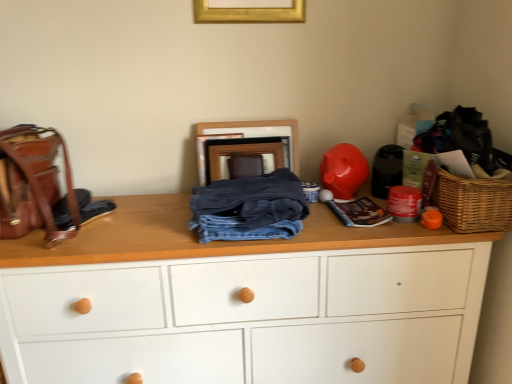
Question: Is white painted wood chest of drawers at center located outside denim fabric pants at center?

Choices:
 (A) yes
 (B) no

Answer: (A)

Question: Is denim fabric pants at center at the back of white painted wood chest of drawers at center?

Choices:
 (A) yes
 (B) no

Answer: (B)

Question: From a real-world perspective, is white painted wood chest of drawers at center on denim fabric pants at center?

Choices:
 (A) yes
 (B) no

Answer: (B)

Question: Considering the relative sizes of white painted wood chest of drawers at center and denim fabric pants at center in the image provided, is white painted wood chest of drawers at center taller than denim fabric pants at center?

Choices:
 (A) yes
 (B) no

Answer: (A)

Question: Can you confirm if white painted wood chest of drawers at center is positioned to the left of denim fabric pants at center?

Choices:
 (A) yes
 (B) no

Answer: (A)

Question: From the image's perspective, is white painted wood chest of drawers at center on top of denim fabric pants at center?

Choices:
 (A) yes
 (B) no

Answer: (B)

Question: Can you confirm if denim fabric pants at center is bigger than woven brown picnic basket at right?

Choices:
 (A) yes
 (B) no

Answer: (A)

Question: From the image's perspective, is denim fabric pants at center located beneath woven brown picnic basket at right?

Choices:
 (A) yes
 (B) no

Answer: (A)

Question: Does denim fabric pants at center have a smaller size compared to woven brown picnic basket at right?

Choices:
 (A) no
 (B) yes

Answer: (A)

Question: Can you confirm if denim fabric pants at center is taller than woven brown picnic basket at right?

Choices:
 (A) yes
 (B) no

Answer: (B)

Question: Is denim fabric pants at center shorter than woven brown picnic basket at right?

Choices:
 (A) yes
 (B) no

Answer: (A)

Question: From a real-world perspective, is denim fabric pants at center located higher than woven brown picnic basket at right?

Choices:
 (A) no
 (B) yes

Answer: (A)

Question: From a real-world perspective, is leather backpack at left physically above shiny plastic piggy bank at right?

Choices:
 (A) yes
 (B) no

Answer: (A)